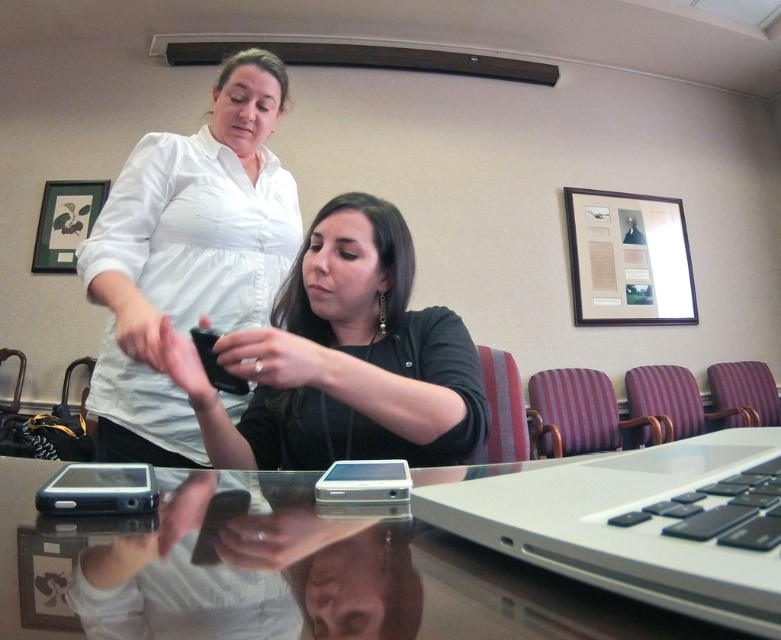
You are standing in the conference room and want to reach the point marked at coordinates point (476, 378). If you have a 30 inch long measuring tape, can you determine if you can reach that point with the tape from your current position?

The distance between you and point (476, 378) is 32.54 inches. Since your measuring tape is only 30 inches long, you cannot reach the point with it.

You are organizing a meeting and need to place a document on the transparent glass table at center so that it doesn t cover the black matte phone at center. Can you fit the document next to the phone without overlapping?

The transparent glass table at center is larger in size than black matte phone at center, so yes, there is enough space to place the document next to the black matte phone at center without overlapping.